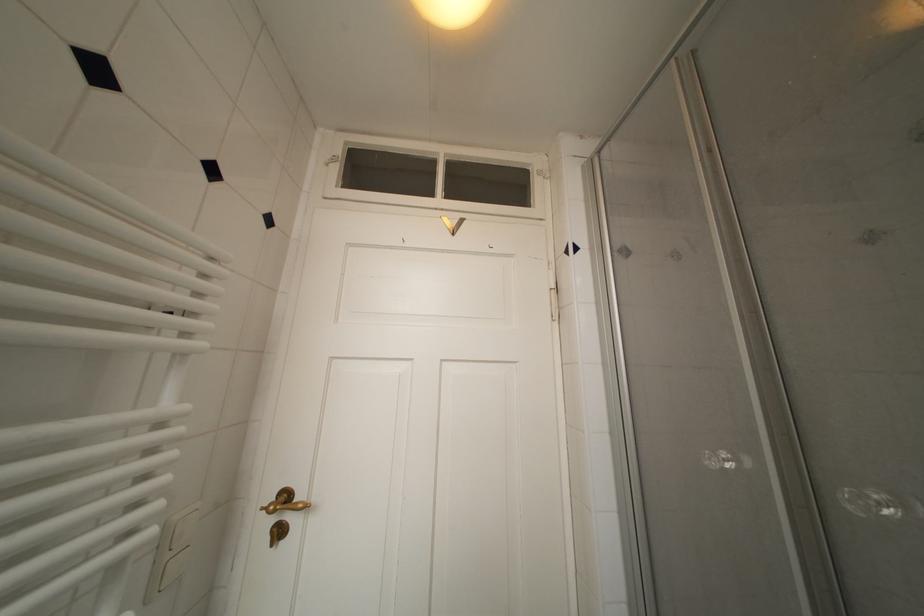
Image resolution: width=924 pixels, height=616 pixels. Describe the element at coordinates (332, 159) in the screenshot. I see `the white window latch` at that location.